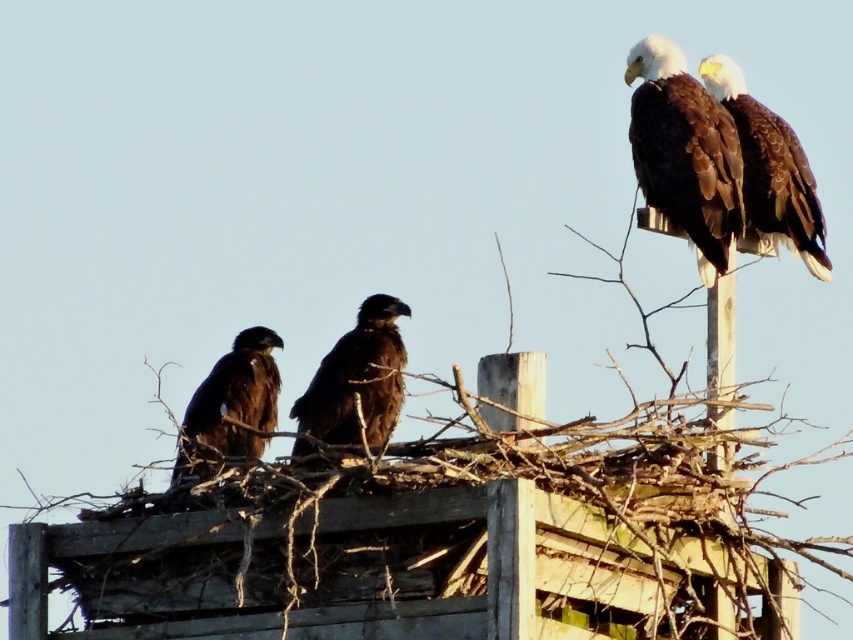
What do you see at coordinates (770, 170) in the screenshot? I see `dark brown feathers at upper right` at bounding box center [770, 170].

Between dark brown feathers at upper right and brown feathered eagle at center, which one is positioned lower?

brown feathered eagle at center is lower down.

Where is `dark brown feathers at upper right`? This screenshot has width=853, height=640. dark brown feathers at upper right is located at coordinates (770, 170).

In the scene shown: Is brown feathered eagle at upper right taller than brown feathered eagle at center?

Yes, brown feathered eagle at upper right is taller than brown feathered eagle at center.

Between point (654, 100) and point (329, 394), which one is positioned behind?

The point (654, 100) is more distant.

Where is `brown feathered eagle at upper right`? brown feathered eagle at upper right is located at coordinates (683, 152).

Locate an element on the screen. The width and height of the screenshot is (853, 640). brown feathered eagle at upper right is located at coordinates tap(683, 152).

Is point (703, 72) behind point (274, 333)?

No, (703, 72) is closer to viewer.

Is point (770, 179) closer to camera compared to point (223, 440)?

No, (770, 179) is behind (223, 440).

I want to click on dark brown feathers at upper right, so click(x=770, y=170).